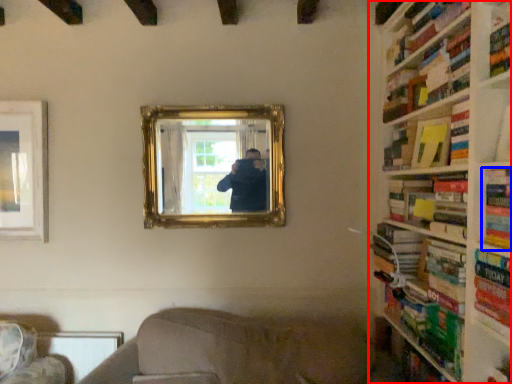
Question: Which object is closer to the camera taking this photo, bookcase (highlighted by a red box) or book (highlighted by a blue box)?

Choices:
 (A) bookcase
 (B) book

Answer: (A)